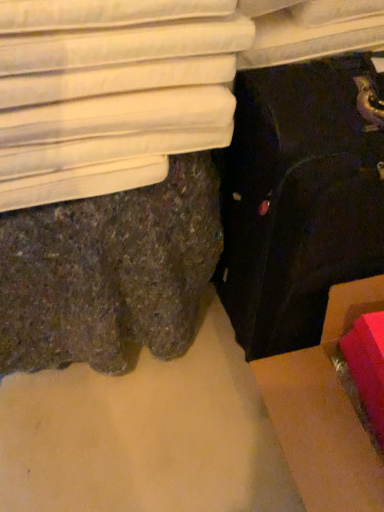
Question: From a real-world perspective, is cardboard box at lower right on top of white fabric bed at upper left?

Choices:
 (A) yes
 (B) no

Answer: (B)

Question: Does cardboard box at lower right have a lesser width compared to white fabric bed at upper left?

Choices:
 (A) no
 (B) yes

Answer: (A)

Question: Does cardboard box at lower right have a smaller size compared to white fabric bed at upper left?

Choices:
 (A) no
 (B) yes

Answer: (A)

Question: Is cardboard box at lower right bigger than white fabric bed at upper left?

Choices:
 (A) no
 (B) yes

Answer: (B)

Question: From a real-world perspective, is cardboard box at lower right under white fabric bed at upper left?

Choices:
 (A) no
 (B) yes

Answer: (B)

Question: Does cardboard box at lower right have a lesser height compared to white fabric bed at upper left?

Choices:
 (A) yes
 (B) no

Answer: (B)

Question: From a real-world perspective, is black fabric suitcase at lower right located beneath cardboard box at lower right?

Choices:
 (A) yes
 (B) no

Answer: (B)

Question: Does black fabric suitcase at lower right appear on the right side of cardboard box at lower right?

Choices:
 (A) no
 (B) yes

Answer: (A)

Question: Is black fabric suitcase at lower right closer to camera compared to cardboard box at lower right?

Choices:
 (A) yes
 (B) no

Answer: (A)

Question: Does black fabric suitcase at lower right have a smaller size compared to cardboard box at lower right?

Choices:
 (A) yes
 (B) no

Answer: (B)

Question: Is black fabric suitcase at lower right wider than cardboard box at lower right?

Choices:
 (A) yes
 (B) no

Answer: (B)

Question: Is black fabric suitcase at lower right placed right next to cardboard box at lower right?

Choices:
 (A) no
 (B) yes

Answer: (A)

Question: Can you confirm if white fabric bed at upper left is bigger than cardboard box at lower right?

Choices:
 (A) no
 (B) yes

Answer: (A)